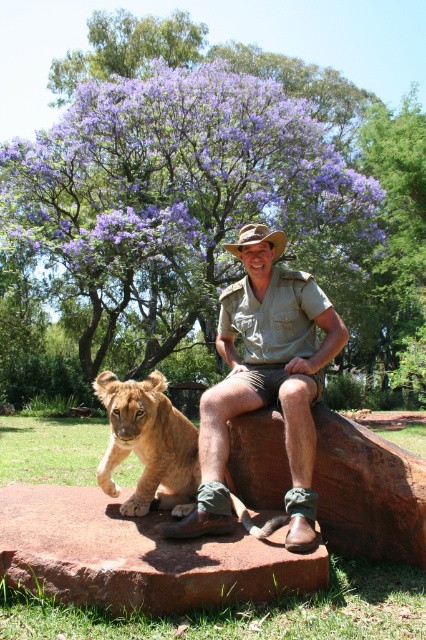
Between purple leafy tree at upper center and golden fur cub at lower left, which one appears on the left side from the viewer's perspective?

Positioned to the left is golden fur cub at lower left.

Based on the photo, between purple leafy tree at upper center and golden fur cub at lower left, which one is positioned higher?

Positioned higher is purple leafy tree at upper center.

Is point (322, 225) behind point (189, 508)?

Yes, point (322, 225) is farther from viewer.

Find the location of a particular element. purple leafy tree at upper center is located at coordinates (199, 204).

Does purple leafy tree at upper center have a lesser width compared to green canvas shirt at center?

In fact, purple leafy tree at upper center might be wider than green canvas shirt at center.

Does purple leafy tree at upper center have a greater width compared to green canvas shirt at center?

Correct, the width of purple leafy tree at upper center exceeds that of green canvas shirt at center.

Locate an element on the screen. purple leafy tree at upper center is located at coordinates (199, 204).

Who is shorter, brown stone at lower center or golden fur cub at lower left?

Standing shorter between the two is brown stone at lower center.

Can you confirm if brown stone at lower center is positioned to the right of golden fur cub at lower left?

Incorrect, brown stone at lower center is not on the right side of golden fur cub at lower left.

Between point (181, 582) and point (101, 376), which one is positioned behind?

The point (101, 376) is behind.

I want to click on brown stone at lower center, so click(x=138, y=556).